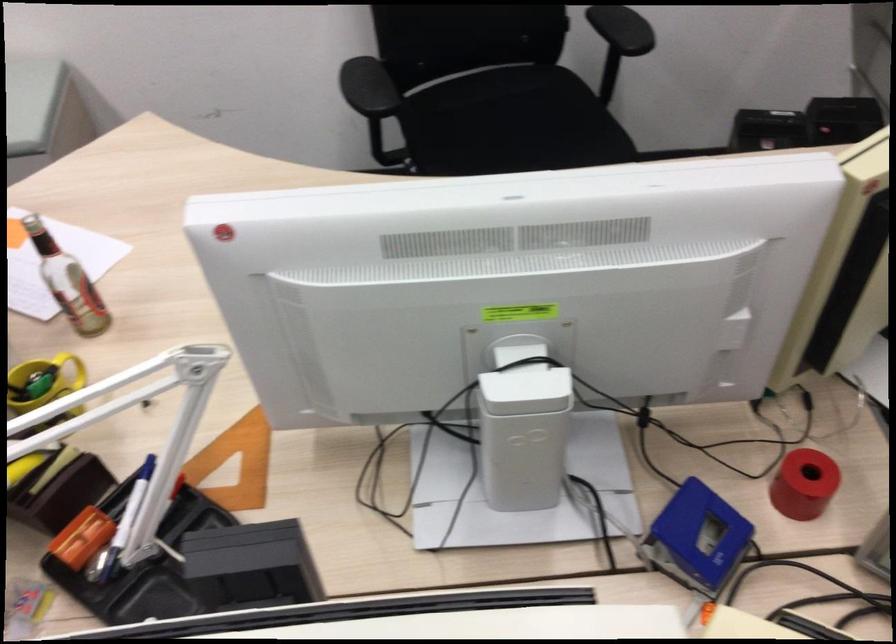
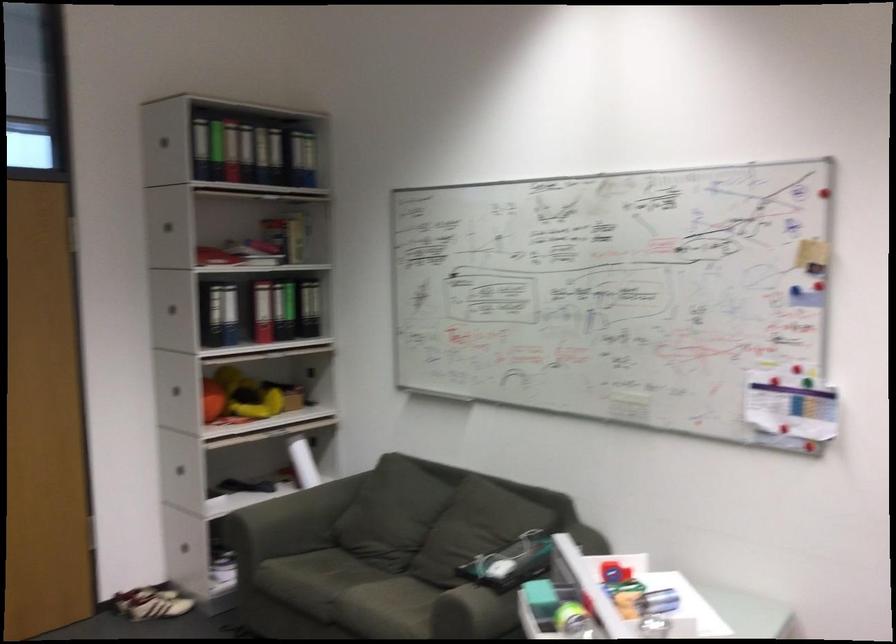
The images are taken continuously from a first-person perspective. In which direction is your viewpoint rotating?

The camera's rotation is toward left-up.